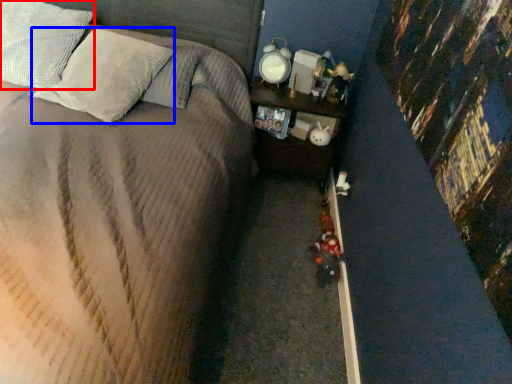
Question: Which object is closer to the camera taking this photo, pillow (highlighted by a red box) or pillow (highlighted by a blue box)?

Choices:
 (A) pillow
 (B) pillow

Answer: (B)